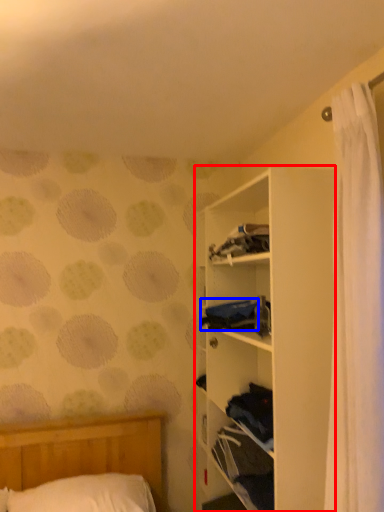
Question: Which point is closer to the camera, shelf (highlighted by a red box) or clothing (highlighted by a blue box)?

Choices:
 (A) shelf
 (B) clothing

Answer: (A)